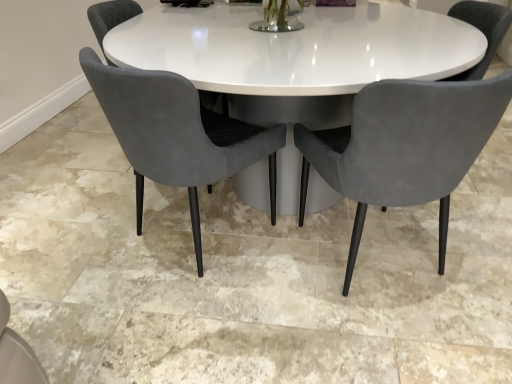
Find the location of `vacant space in front of velvet grey chair at center, which ranks as the second chair in right-to-left order`. vacant space in front of velvet grey chair at center, which ranks as the second chair in right-to-left order is located at coordinates (184, 329).